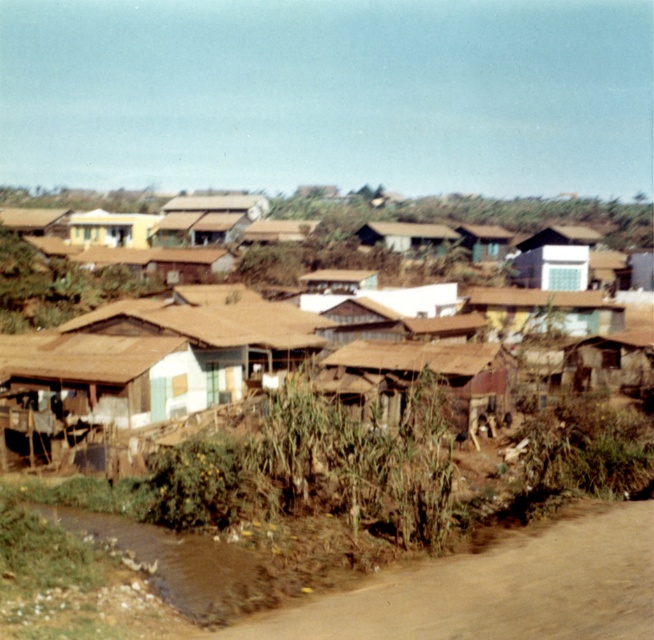
You are a visitor approaching the settlement along the dirt path. You see the brown thatched roof houses at center and the brown corrugated metal hut at center. Which structure is closer to you as you walk along the path?

The brown thatched roof houses at center is positioned over the brown corrugated metal hut at center, meaning it is closer to you as you walk along the path.

You are a traveler approaching the rural settlement from the dirt path. You notice the brown thatched roof houses at center and the brown dirt track at lower right. Which structure is taller?

The brown thatched roof houses at center are much taller than the brown dirt track at lower right.